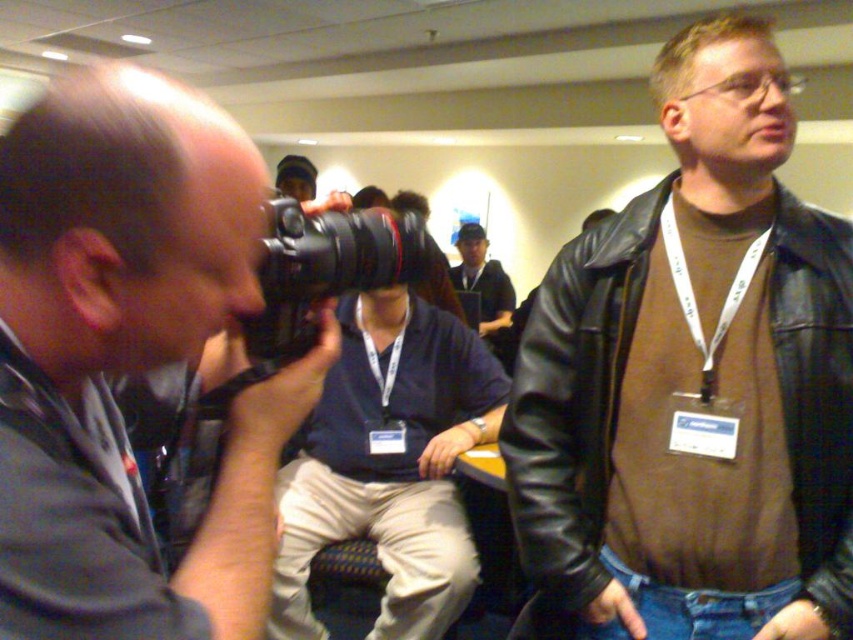
You are organizing a photography exhibition and need to arrange the black plastic camera at center and the blue fabric cap at center on a display shelf. Given their sizes, which object should be placed first to ensure both fit properly?

The black plastic camera at center occupies less space than the blue fabric cap at center, so you should place the blue fabric cap at center first to ensure both fit properly.